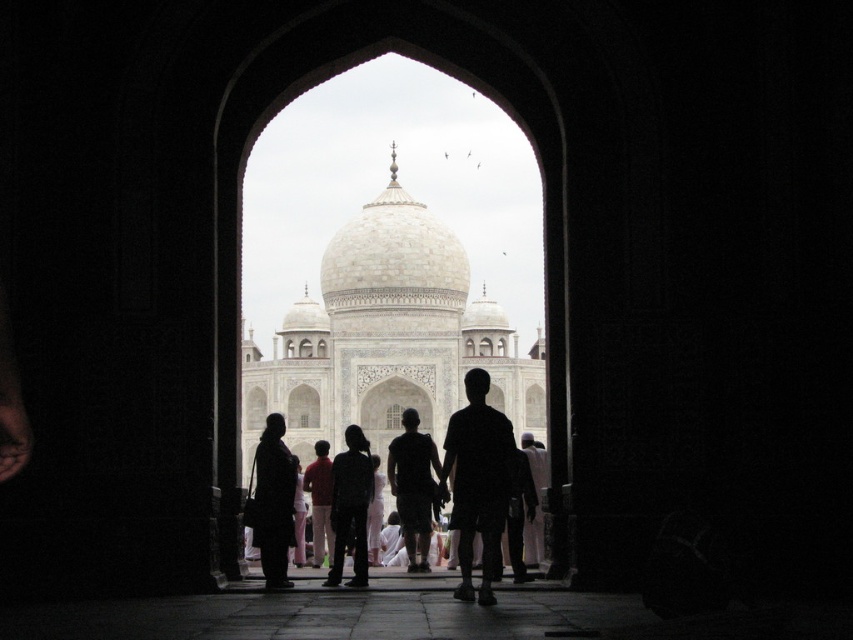
You are standing inside the darkened archway and want to find the dark fabric dress at center. According to the coordinates provided, where should you look relative to the archway?

The dark fabric dress at center is located at coordinates point (x=273, y=500), which means it is positioned towards the right side and slightly above the center of the archway.

You are standing in the archway and see two people in front of you. One is wearing a dark fabric dress at center and the other a red cotton shirt at center. Which person appears closer to you?

The dark fabric dress at center is smaller than the red cotton shirt at center, so the person in the red cotton shirt at center is closer because objects closer appear larger.